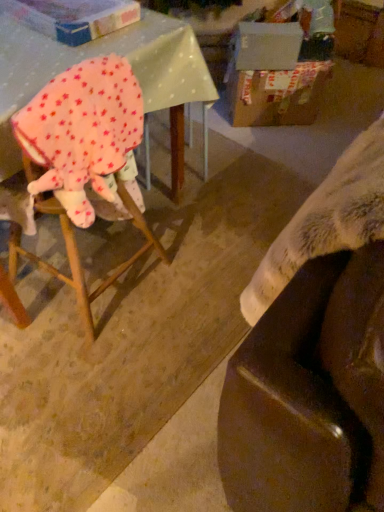
The image size is (384, 512). Find the location of `vacant region in front of cardboard box at upper right, arranged as the second cardboard box when viewed from the front`. vacant region in front of cardboard box at upper right, arranged as the second cardboard box when viewed from the front is located at coordinates (278, 141).